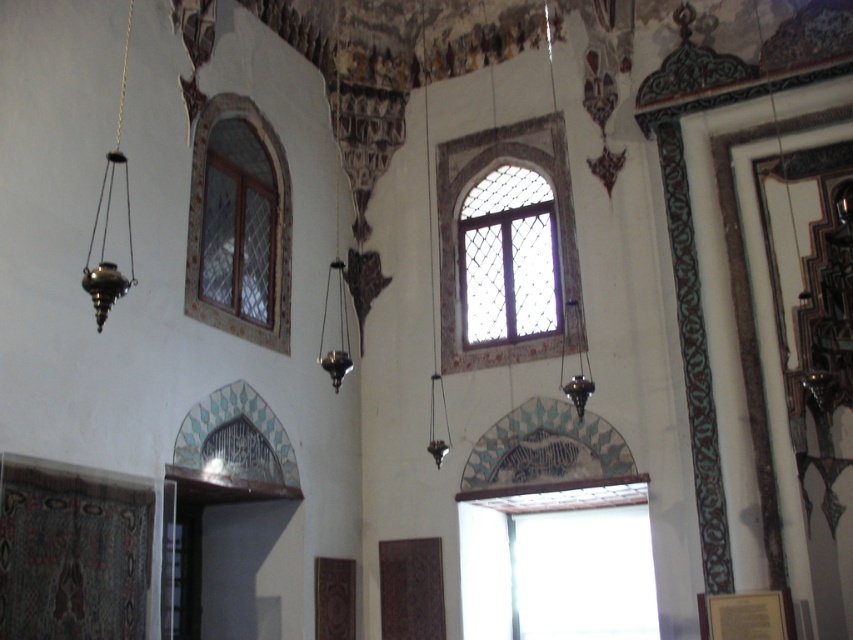
Can you confirm if textured woolen tapestry at lower left is positioned to the left of brass/metallic lamp at left?

No, textured woolen tapestry at lower left is not to the left of brass/metallic lamp at left.

Which is below, textured woolen tapestry at lower left or brass/metallic lamp at left?

textured woolen tapestry at lower left is lower down.

Who is more distant from viewer, (x=0, y=465) or (x=126, y=54)?

The point (x=126, y=54) is more distant.

Where is `textured woolen tapestry at lower left`? textured woolen tapestry at lower left is located at coordinates click(73, 552).

Image resolution: width=853 pixels, height=640 pixels. Describe the element at coordinates (550, 560) in the screenshot. I see `transparent glass window at center` at that location.

Which is above, transparent glass window at center or dark brown wooden window at center?

Positioned higher is dark brown wooden window at center.

Measure the distance between transparent glass window at center and camera.

They are 38.41 feet apart.

Locate an element on the screen. The height and width of the screenshot is (640, 853). transparent glass window at center is located at coordinates (550, 560).

Does brass/metallic lamp at left have a lesser height compared to metallic hanging lamp at center?

No.

What do you see at coordinates (107, 220) in the screenshot? I see `brass/metallic lamp at left` at bounding box center [107, 220].

Locate an element on the screen. brass/metallic lamp at left is located at coordinates (107, 220).